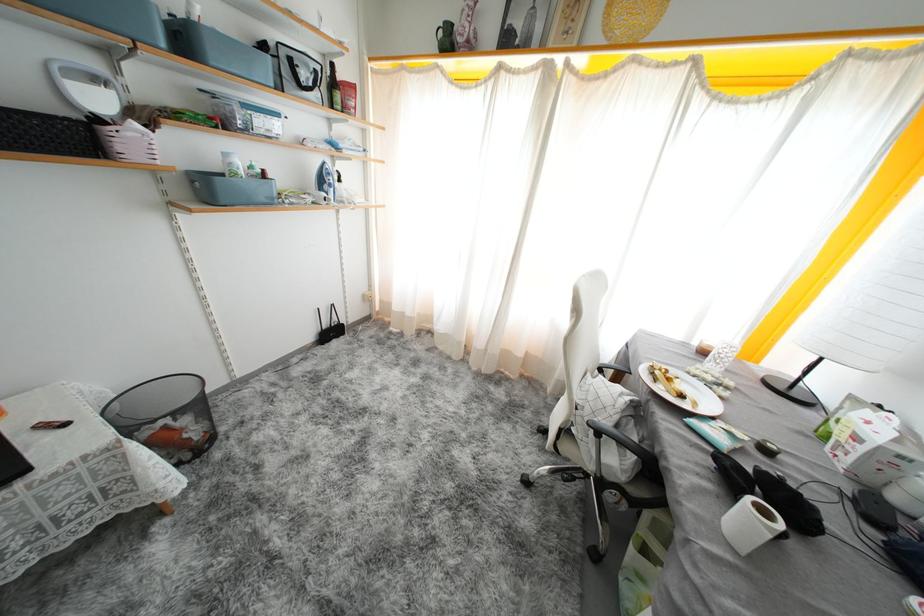
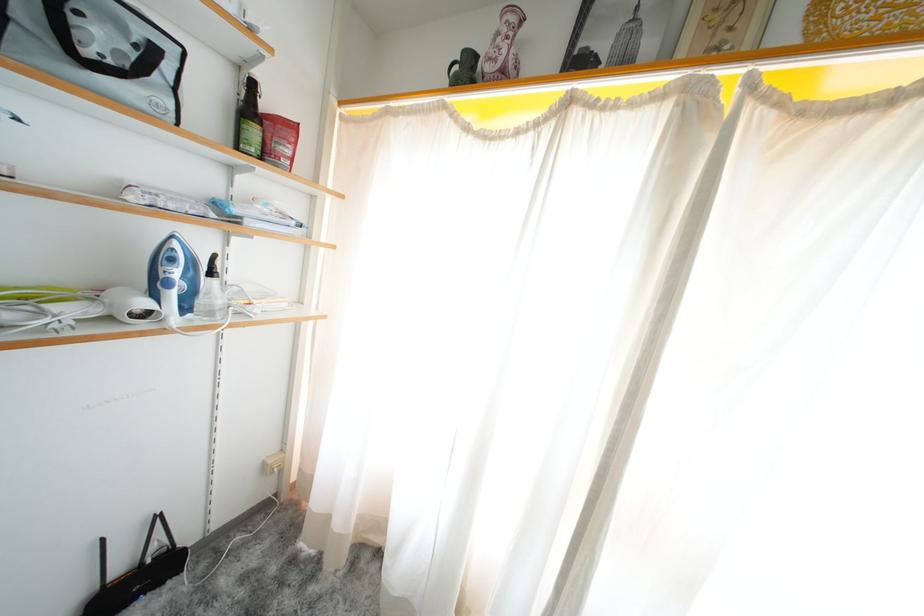
Question: I am providing you with two images of the same scene from different viewpoints. After the viewpoint changes to image2, which objects are now occluded?

Choices:
 (A) black wifi router
 (B) spray bottle pump
 (C) white hairdryer
 (D) none of these

Answer: (D)